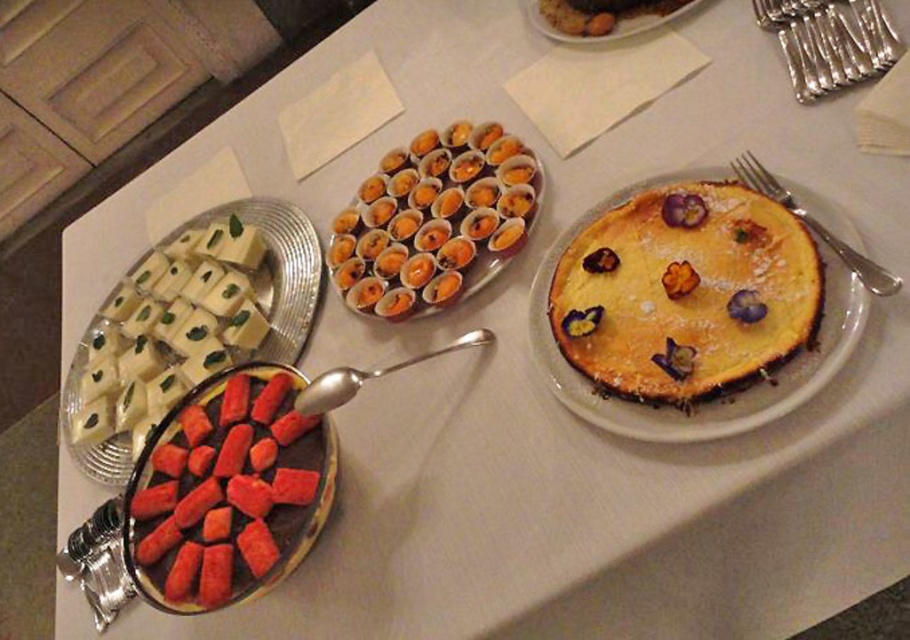
Is silver metallic forks at upper right below smooth ceramic plate at upper center?

Correct, silver metallic forks at upper right is located below smooth ceramic plate at upper center.

The height and width of the screenshot is (640, 910). I want to click on silver metallic forks at upper right, so click(x=830, y=42).

Who is positioned more to the left, white creamy cheese at upper left or silver fork at right?

white creamy cheese at upper left

Where is `white creamy cheese at upper left`? The height and width of the screenshot is (640, 910). white creamy cheese at upper left is located at coordinates (231, 349).

Can you confirm if dark red glossy strawberries at lower left is bigger than silver metallic forks at upper right?

Correct, dark red glossy strawberries at lower left is larger in size than silver metallic forks at upper right.

Which is in front, point (200, 570) or point (787, 49)?

Point (200, 570)

Between point (235, 369) and point (759, 17), which one is positioned in front?

Positioned in front is point (235, 369).

This screenshot has height=640, width=910. I want to click on dark red glossy strawberries at lower left, so click(x=228, y=492).